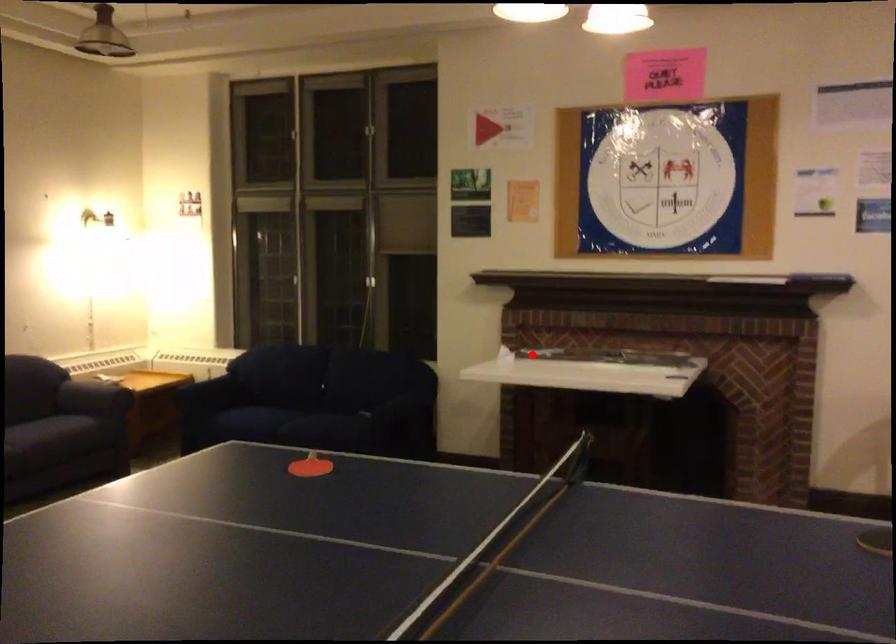
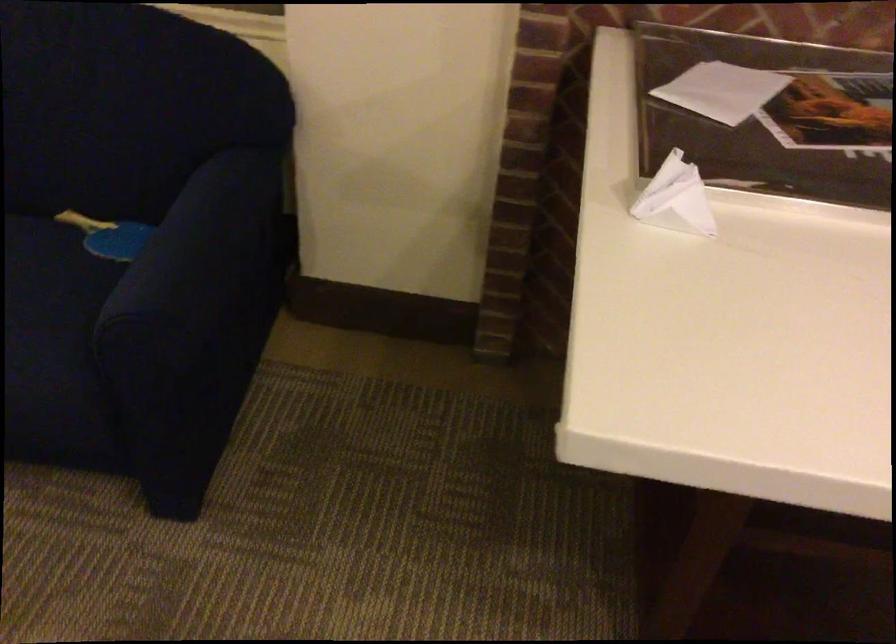
Question: I am providing you with two images of the same scene from different viewpoints. Image1 has a red point marked. In image2, the corresponding 3D location appears at what relative position? Reply with the corresponding letter.

Choices:
 (A) Closer
 (B) Farther

Answer: (A)